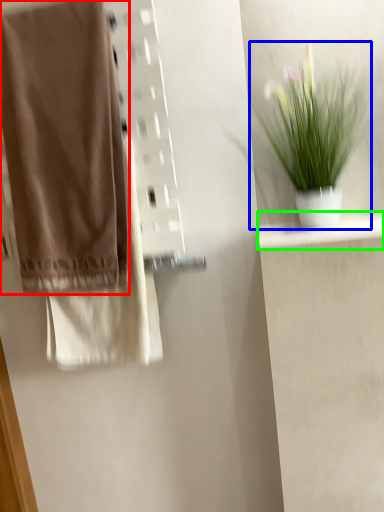
Question: Considering the real-world distances, which object is farthest from towel (highlighted by a red box)? houseplant (highlighted by a blue box) or shelf (highlighted by a green box)?

Choices:
 (A) houseplant
 (B) shelf

Answer: (B)